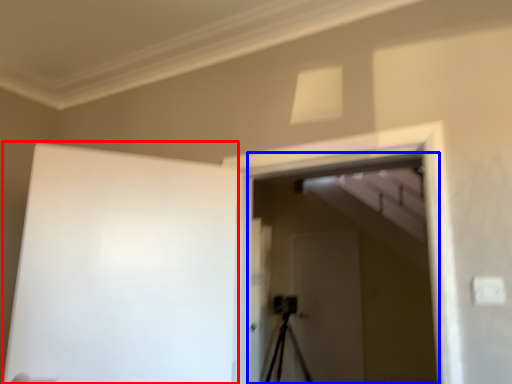
Question: Which object is closer to the camera taking this photo, barn door (highlighted by a red box) or screen door (highlighted by a blue box)?

Choices:
 (A) barn door
 (B) screen door

Answer: (A)